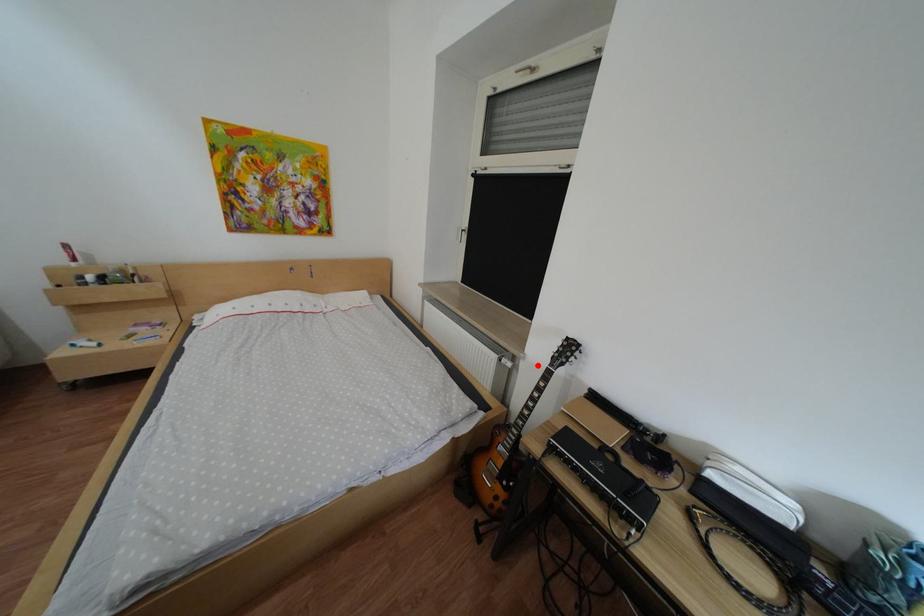
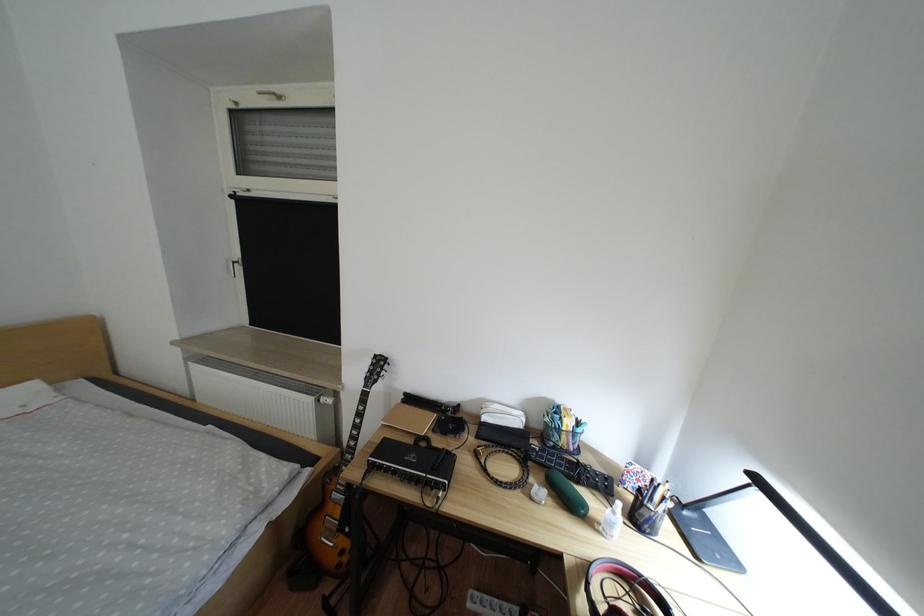
Question: I am providing you with two images of the same scene from different viewpoints. In image1, a red point is highlighted. Considering the same 3D point in image2, which of the following is correct?

Choices:
 (A) It is closer
 (B) It is farther

Answer: (B)